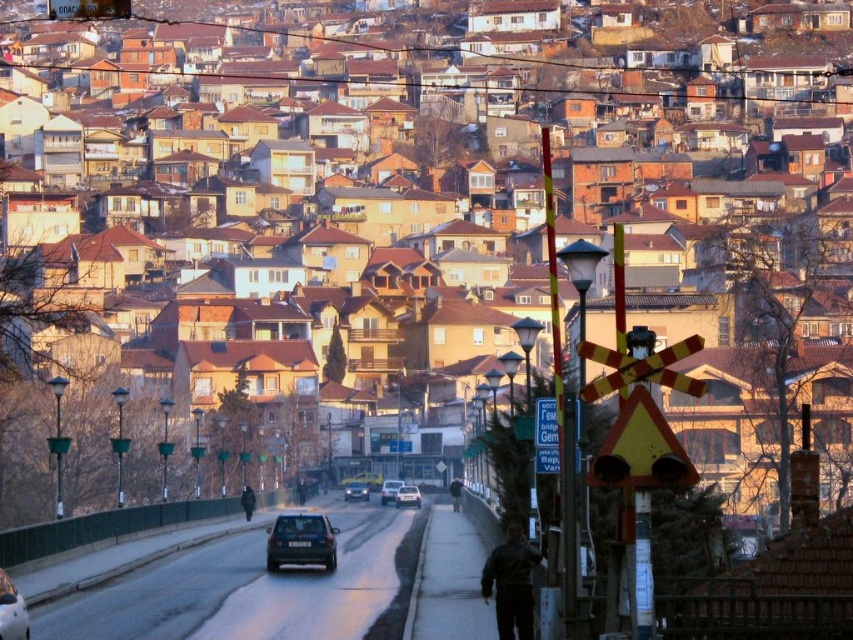
Question: Which object is farther from the camera taking this photo?

Choices:
 (A) matte black car at center
 (B) shiny silver car at lower left
 (C) dark brown leather jacket at lower center

Answer: (A)

Question: Which point is farther from the camera taking this photo?

Choices:
 (A) (1, 593)
 (B) (519, 566)
 (C) (393, 497)

Answer: (C)

Question: Where is dark brown leather jacket at lower center located in relation to satin black car at center in the image?

Choices:
 (A) left
 (B) right

Answer: (B)

Question: Can you confirm if shiny black sedan at center is wider than black leather jacket at center?

Choices:
 (A) yes
 (B) no

Answer: (A)

Question: Can you confirm if dark brown leather jacket at lower center is thinner than black matte person at center?

Choices:
 (A) yes
 (B) no

Answer: (B)

Question: Which object is the farthest from the yellow matte traffic sign at center?

Choices:
 (A) shiny black sedan at center
 (B) shiny silver car at lower left

Answer: (A)